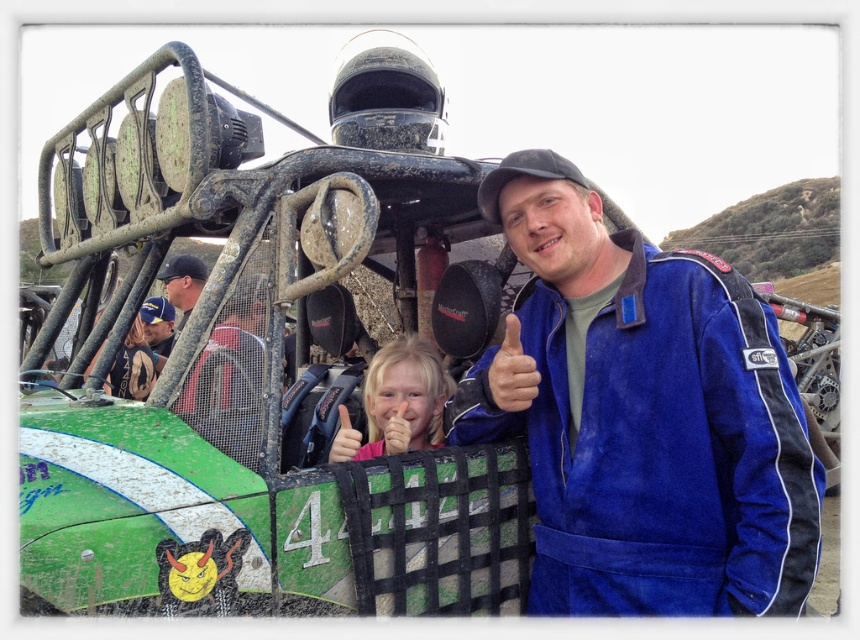
Question: Does smooth skin hand at center have a smaller size compared to pink matte hand at center?

Choices:
 (A) yes
 (B) no

Answer: (B)

Question: Can you confirm if blonde hair at center is positioned to the left of pink matte hand at center?

Choices:
 (A) no
 (B) yes

Answer: (A)

Question: Considering the real-world distances, which object is farthest from the pink matte hand at center?

Choices:
 (A) matte black helmet at upper center
 (B) smooth skin hand at center
 (C) blue suede jacket at center
 (D) blonde hair at center

Answer: (A)

Question: Among these points, which one is farthest from the camera?

Choices:
 (A) (404, 426)
 (B) (195, 289)
 (C) (490, 396)
 (D) (357, 435)

Answer: (B)

Question: Does matte black helmet at upper center appear on the left side of pink matte hand at center?

Choices:
 (A) yes
 (B) no

Answer: (A)

Question: Which point appears closest to the camera in this image?

Choices:
 (A) (751, 394)
 (B) (161, 278)
 (C) (424, 394)

Answer: (A)